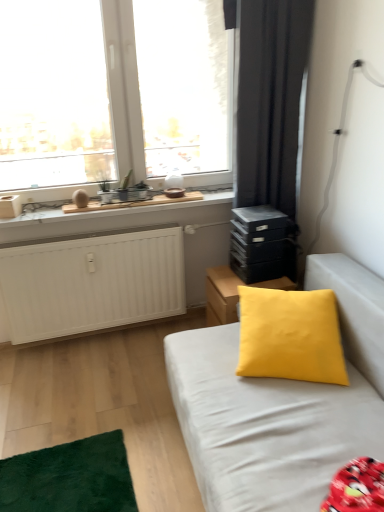
Question: Considering the relative sizes of black matte stack of drawers at right and black matte curtain at upper right in the image provided, is black matte stack of drawers at right smaller than black matte curtain at upper right?

Choices:
 (A) yes
 (B) no

Answer: (A)

Question: Is black matte stack of drawers at right further to the viewer compared to black matte curtain at upper right?

Choices:
 (A) no
 (B) yes

Answer: (B)

Question: Considering the relative sizes of black matte stack of drawers at right and black matte curtain at upper right in the image provided, is black matte stack of drawers at right bigger than black matte curtain at upper right?

Choices:
 (A) yes
 (B) no

Answer: (B)

Question: Is there a large distance between black matte stack of drawers at right and black matte curtain at upper right?

Choices:
 (A) yes
 (B) no

Answer: (B)

Question: Is black matte curtain at upper right surrounded by black matte stack of drawers at right?

Choices:
 (A) no
 (B) yes

Answer: (A)

Question: Looking at their shapes, would you say transparent glass window at upper left is wider or thinner than yellow fabric cushion at center?

Choices:
 (A) thin
 (B) wide

Answer: (A)

Question: Is transparent glass window at upper left taller or shorter than yellow fabric cushion at center?

Choices:
 (A) short
 (B) tall

Answer: (B)

Question: Based on their sizes in the image, would you say transparent glass window at upper left is bigger or smaller than yellow fabric cushion at center?

Choices:
 (A) small
 (B) big

Answer: (B)

Question: From a real-world perspective, is transparent glass window at upper left above or below yellow fabric cushion at center?

Choices:
 (A) below
 (B) above

Answer: (B)

Question: Considering the positions of point (178, 347) and point (226, 32), is point (178, 347) closer or farther from the camera than point (226, 32)?

Choices:
 (A) closer
 (B) farther

Answer: (A)

Question: Considering their positions, is yellow matte pillow at center located in front of or behind transparent glass window at upper left?

Choices:
 (A) behind
 (B) front

Answer: (B)

Question: From a real-world perspective, is yellow matte pillow at center physically located above or below transparent glass window at upper left?

Choices:
 (A) below
 (B) above

Answer: (A)

Question: Is yellow matte pillow at center spatially inside transparent glass window at upper left, or outside of it?

Choices:
 (A) outside
 (B) inside

Answer: (A)

Question: Is point (210, 293) positioned closer to the camera than point (306, 389)?

Choices:
 (A) farther
 (B) closer

Answer: (A)

Question: Is yellow fabric cushion at center spatially inside yellow matte pillow at center, or outside of it?

Choices:
 (A) outside
 (B) inside

Answer: (A)